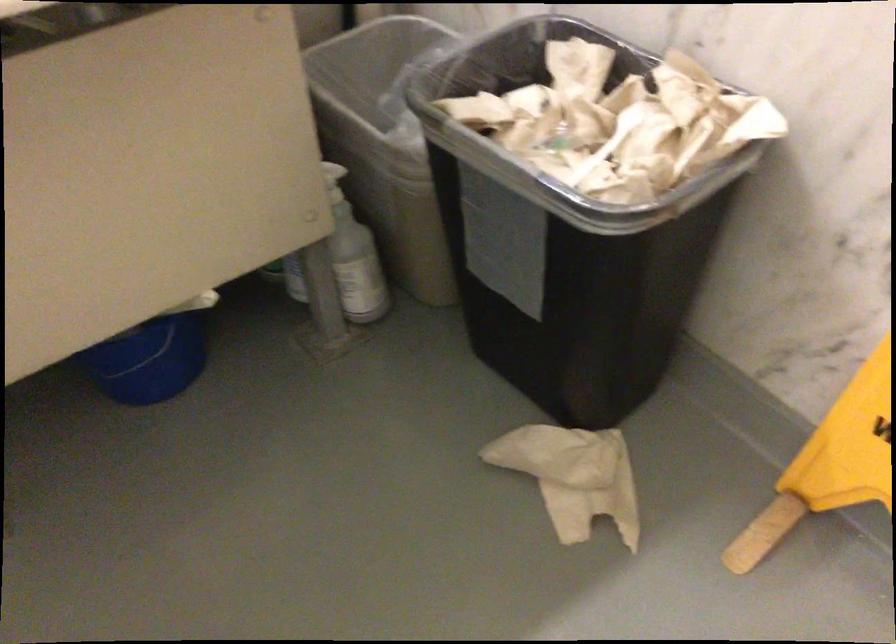
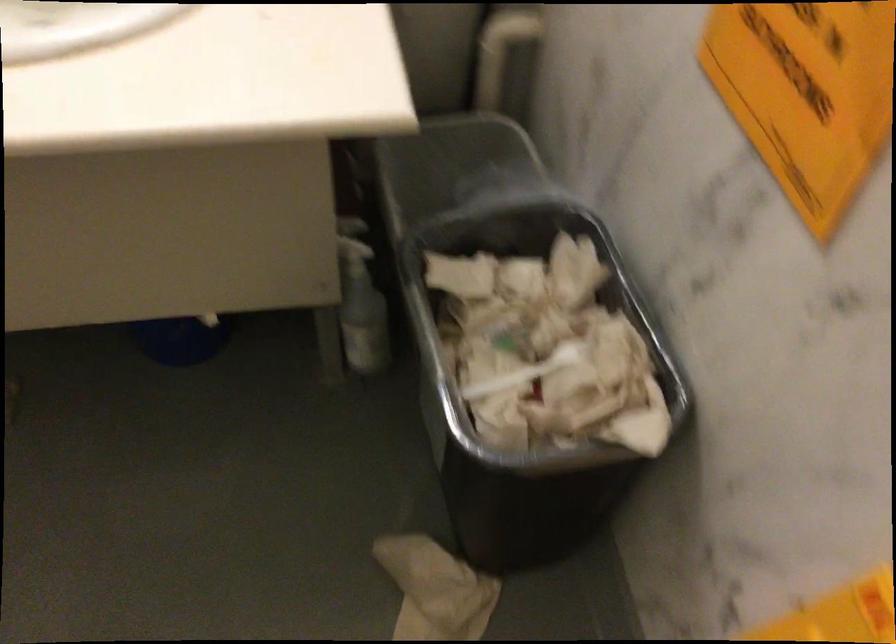
Locate, in the second image, the point that corresponds to the point at 355,240 in the first image.

(360, 303)